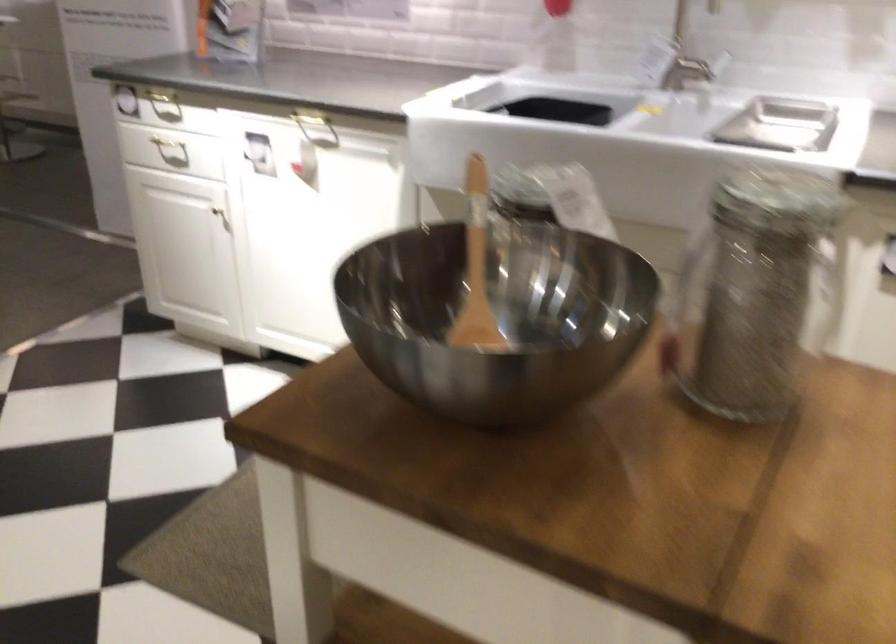
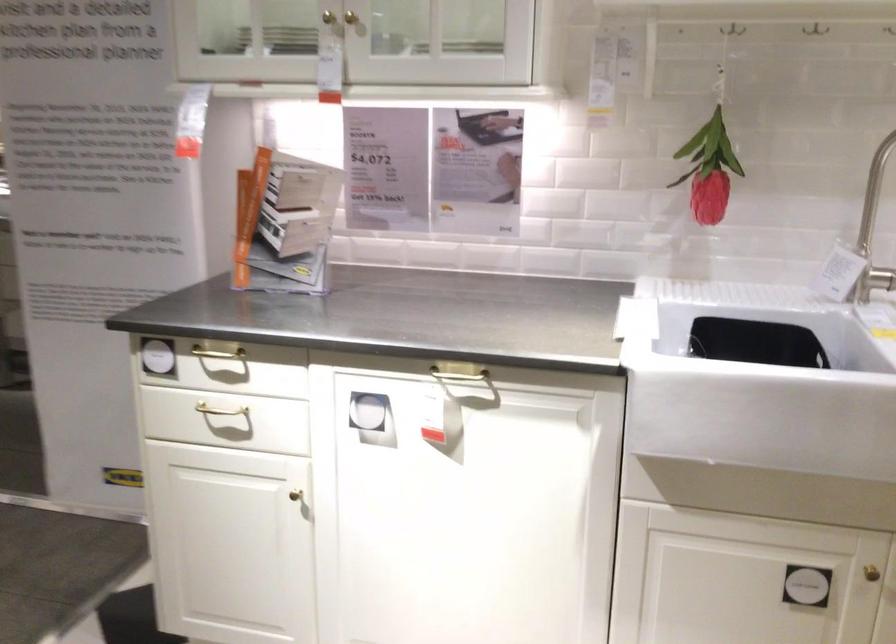
In the second image, find the point that corresponds to the point at 165,98 in the first image.

(218, 353)